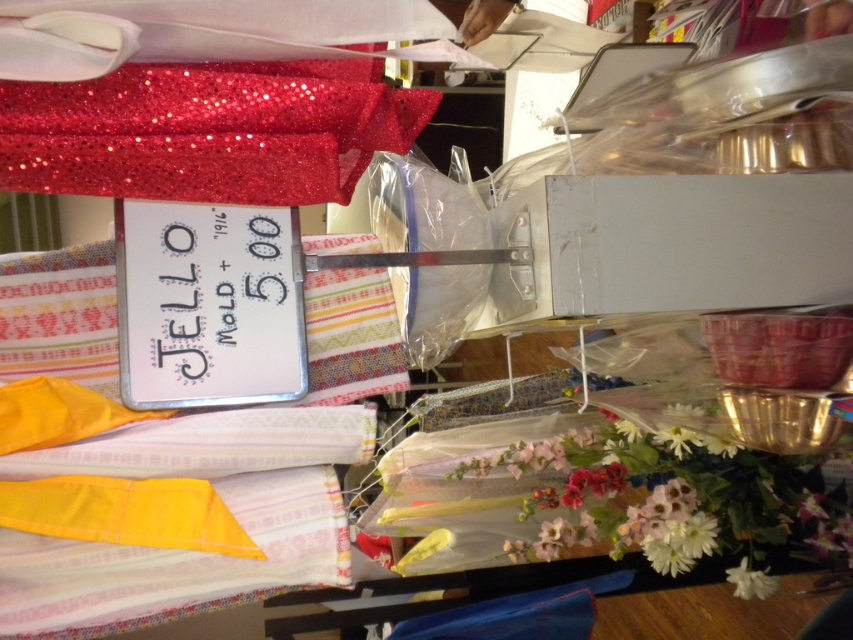
Question: Which point is farther to the camera?

Choices:
 (A) click(669, 572)
 (B) click(747, 570)
 (C) click(9, 186)

Answer: (B)

Question: Is the position of glittery red fabric at upper left less distant than that of white matte flower at lower right?

Choices:
 (A) no
 (B) yes

Answer: (B)

Question: In this image, where is glittery red fabric at upper left located relative to white matte flower at lower right?

Choices:
 (A) left
 (B) right

Answer: (A)

Question: Which of these objects is positioned farthest from the white fabric flower at lower right?

Choices:
 (A) glittery red fabric at upper left
 (B) white matte flower at lower right

Answer: (A)

Question: Which of the following is the closest to the observer?

Choices:
 (A) (10, 120)
 (B) (730, 570)

Answer: (A)

Question: Can you confirm if glittery red fabric at upper left is positioned below white fabric flower at lower right?

Choices:
 (A) yes
 (B) no

Answer: (B)